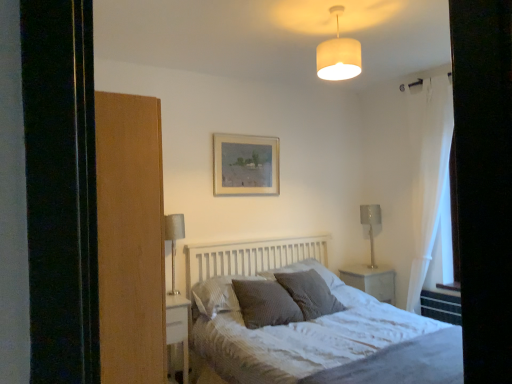
Question: From a real-world perspective, is white wood bed at center physically above white fabric lampshade at upper center?

Choices:
 (A) yes
 (B) no

Answer: (B)

Question: Is white wood bed at center at the left side of white fabric lampshade at upper center?

Choices:
 (A) yes
 (B) no

Answer: (B)

Question: Considering the relative sizes of white wood bed at center and white fabric lampshade at upper center in the image provided, is white wood bed at center smaller than white fabric lampshade at upper center?

Choices:
 (A) no
 (B) yes

Answer: (A)

Question: Would you consider white wood bed at center to be distant from white fabric lampshade at upper center?

Choices:
 (A) yes
 (B) no

Answer: (A)

Question: Is white wood bed at center completely or partially outside of white fabric lampshade at upper center?

Choices:
 (A) yes
 (B) no

Answer: (A)

Question: Does white wood bed at center have a greater height compared to white fabric lampshade at upper center?

Choices:
 (A) no
 (B) yes

Answer: (B)

Question: Is metallic silver table lamp at right, the first table lamp when ordered from back to front, looking in the opposite direction of textured gray pillow at center, which ranks as the fourth pillow in left-to-right order?

Choices:
 (A) yes
 (B) no

Answer: (B)

Question: From the image's perspective, would you say metallic silver table lamp at right, which appears as the second table lamp when viewed from the left, is positioned over textured gray pillow at center, which is the first pillow from right to left?

Choices:
 (A) no
 (B) yes

Answer: (B)

Question: Can you confirm if metallic silver table lamp at right, which appears as the second table lamp when viewed from the left, is thinner than textured gray pillow at center, which is the first pillow from right to left?

Choices:
 (A) no
 (B) yes

Answer: (B)

Question: Are metallic silver table lamp at right, the first table lamp when ordered from back to front, and textured gray pillow at center, which ranks as the fourth pillow in left-to-right order, making contact?

Choices:
 (A) yes
 (B) no

Answer: (B)

Question: Is metallic silver table lamp at right, arranged as the second table lamp when viewed from the front, smaller than textured gray pillow at center, which is the first pillow from right to left?

Choices:
 (A) yes
 (B) no

Answer: (A)

Question: From a real-world perspective, is metallic silver table lamp at right, which appears as the second table lamp when viewed from the left, over textured gray pillow at center, which is the first pillow from right to left?

Choices:
 (A) no
 (B) yes

Answer: (B)

Question: Is white glossy nightstand at center, the second nightstand positioned from the left, oriented towards textured gray pillow at center, which is the 2th pillow in right-to-left order?

Choices:
 (A) yes
 (B) no

Answer: (B)